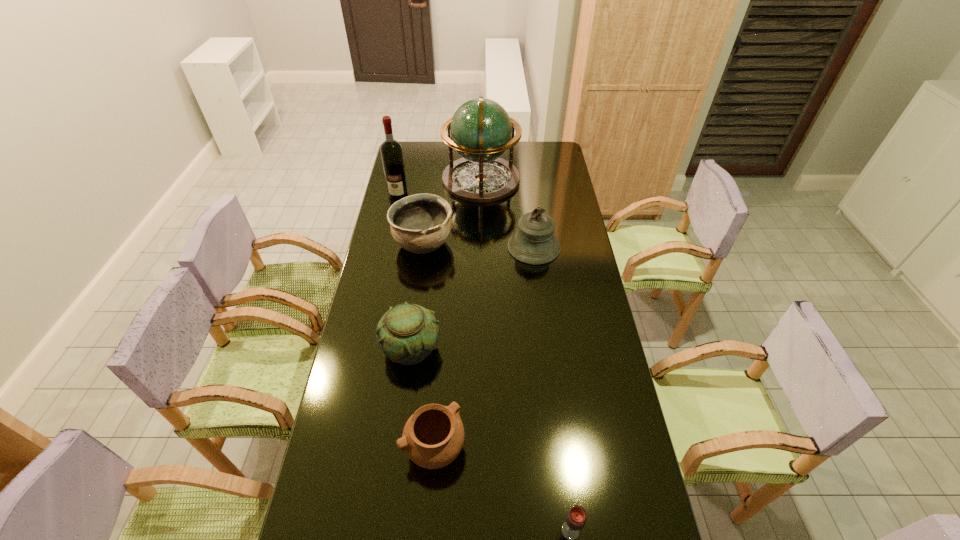
Image resolution: width=960 pixels, height=540 pixels. What are the coordinates of `globe` in the screenshot? It's located at pyautogui.click(x=481, y=130).

Find the location of a particular element. The width and height of the screenshot is (960, 540). alcohol is located at coordinates (391, 151).

Identify the location of bell. This screenshot has width=960, height=540. (534, 243).

Locate an element on the screen. The width and height of the screenshot is (960, 540). the farthest pottery is located at coordinates (421, 223).

You are a GUI agent. You are given a task and a screenshot of the screen. Output one action in this format:
    pyautogui.click(x=<x>, y=<y>)
    Task: Click on the second nearest pottery
    
    Given the screenshot: What is the action you would take?
    pyautogui.click(x=407, y=333)

At what (x,y) coordinates should I click in order to perform the action: click on the second nearest object. Please return your answer as a coordinate pair (x, y). The width and height of the screenshot is (960, 540). Looking at the image, I should click on (433, 437).

In order to click on the shortest pottery in this screenshot , I will do `click(433, 437)`.

Identify the location of vacant space located on the front-facing side of the globe. The height and width of the screenshot is (540, 960). (410, 180).

You are a GUI agent. You are given a task and a screenshot of the screen. Output one action in this format:
    pyautogui.click(x=<x>, y=<y>)
    Task: Click on the free space located 0.190m on the front-facing side of the globe
    This screenshot has height=540, width=960.
    Given the screenshot: What is the action you would take?
    pyautogui.click(x=403, y=180)

In order to click on free point located 0.140m on the front-facing side of the globe in this screenshot , I will do coord(414,180).